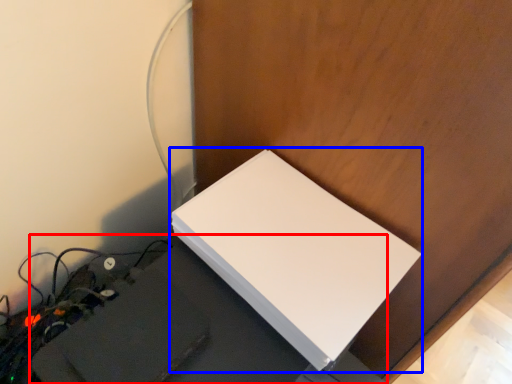
Question: Which object is closer to the camera taking this photo, computer desk (highlighted by a red box) or Wii (highlighted by a blue box)?

Choices:
 (A) computer desk
 (B) Wii

Answer: (A)